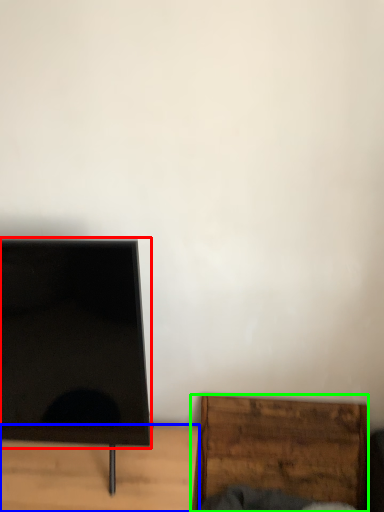
Question: Which object is positioned closest to screen (highlighted by a red box)? Select from furniture (highlighted by a blue box) and furniture (highlighted by a green box).

Choices:
 (A) furniture
 (B) furniture

Answer: (A)